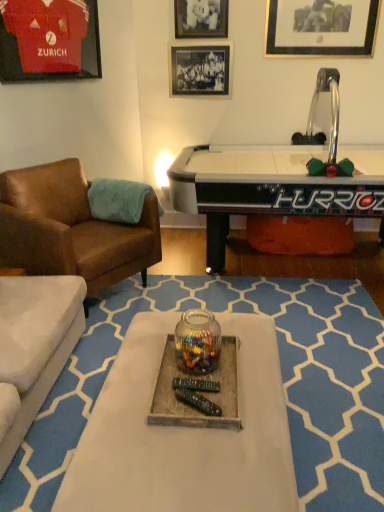
Question: From a real-world perspective, is black matte picture frame at upper center, positioned as the 2th picture frame in left-to-right order, above or below matte jersey at upper left, which appears as the fourth picture frame when viewed from the right?

Choices:
 (A) above
 (B) below

Answer: (B)

Question: Considering the positions of point (190, 52) and point (8, 80), is point (190, 52) closer or farther from the camera than point (8, 80)?

Choices:
 (A) closer
 (B) farther

Answer: (B)

Question: Considering the real-world distances, which object is closest to the black plastic remote control at center, which is counted as the 2th remote control, starting from the front?

Choices:
 (A) black matte picture frame at upper center, positioned as the 2th picture frame in left-to-right order
 (B) brown leather chair at left
 (C) metallic silver picture frame at upper center, acting as the second picture frame starting from the right
 (D) white wood tray at center, which ranks as the 1th table in bottom-to-top order
 (E) white glossy air hockey table at center, the second table in the bottom-to-top sequence

Answer: (D)

Question: Estimate the real-world distances between objects in this image. Which object is closer to the brown leather chair at left?

Choices:
 (A) white wood tray at center, which ranks as the 1th table in bottom-to-top order
 (B) matte jersey at upper left, placed as the first picture frame when sorted from left to right
 (C) black matte picture frame at upper center, positioned as the 3th picture frame in right-to-left order
 (D) black plastic remote control at center, the 1th remote control from the back
 (E) metallic silver picture frame at upper center, positioned as the third picture frame in left-to-right order

Answer: (B)